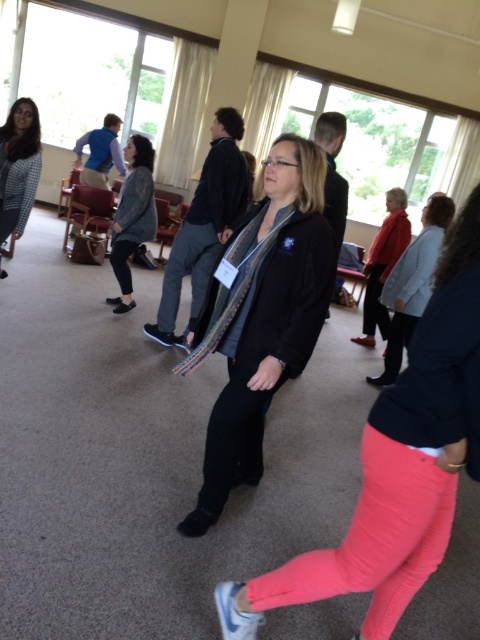
Between matte black jacket at center and black matte jacket at center, which one is positioned higher?

black matte jacket at center is higher up.

Does point (379, 445) lie behind point (289, 365)?

No.

The width and height of the screenshot is (480, 640). Find the location of `matte black jacket at center`. matte black jacket at center is located at coordinates (397, 465).

Is red sweater at right further to camera compared to knitted gray sweater at center?

No, it is in front of knitted gray sweater at center.

Between point (398, 284) and point (126, 269), which one is positioned in front?

Point (398, 284) is more forward.

Between point (384, 384) and point (122, 310), which one is positioned behind?

The point (122, 310) is behind.

The image size is (480, 640). Find the location of `red sweater at right`. red sweater at right is located at coordinates (412, 284).

Which of these two, matte black jacket at center or matte black jacket at left, stands taller?

With more height is matte black jacket at center.

Does matte black jacket at center have a greater height compared to matte black jacket at left?

Indeed, matte black jacket at center has a greater height compared to matte black jacket at left.

Image resolution: width=480 pixels, height=640 pixels. What do you see at coordinates (397, 465) in the screenshot?
I see `matte black jacket at center` at bounding box center [397, 465].

Find the location of a particular element. This screenshot has width=480, height=640. matte black jacket at center is located at coordinates (397, 465).